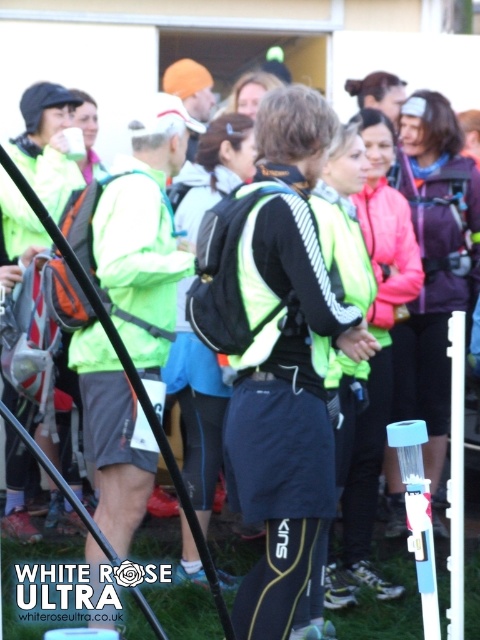
You are a participant in the running event and need to adjust your clothing. Which item, the green matte jacket at center or the green matte vest at center, is currently covering the other?

The green matte jacket at center is positioned under the green matte vest at center, so the vest is covering the jacket.

You are organizing a race and need to distribute items. You have a green matte vest at center and a blue plastic water bottle at center. Which item is wider?

The green matte vest at center is wider than the blue plastic water bottle at center.